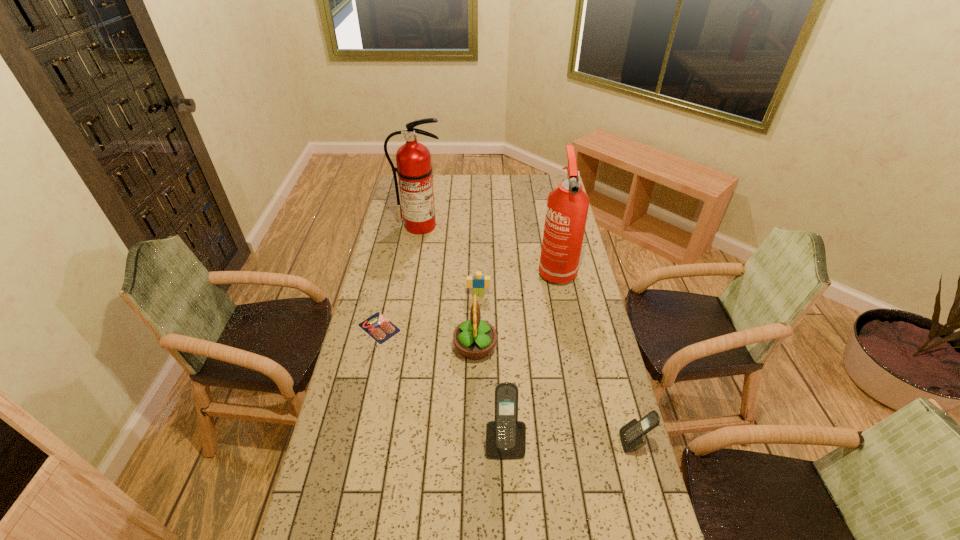
The height and width of the screenshot is (540, 960). I want to click on the left cellular telephone, so click(505, 436).

Where is `the shorter cellular telephone`? Image resolution: width=960 pixels, height=540 pixels. the shorter cellular telephone is located at coordinates (632, 435).

Image resolution: width=960 pixels, height=540 pixels. I want to click on the right cellular telephone, so click(x=632, y=435).

Find the location of a particular element. The width and height of the screenshot is (960, 540). the farthest object is located at coordinates (414, 169).

Find the location of a particular element. The width and height of the screenshot is (960, 540). the farther fire extinguisher is located at coordinates (414, 169).

Identify the location of the sixth tallest object. The height and width of the screenshot is (540, 960). (478, 282).

Identify the location of the third farthest object. (478, 282).

Find the location of `the nearer fire extinguisher`. the nearer fire extinguisher is located at coordinates (567, 207).

This screenshot has width=960, height=540. In order to click on the second farthest object in this screenshot , I will do [x=567, y=207].

Locate an element on the screen. Image resolution: width=960 pixels, height=540 pixels. salami is located at coordinates (377, 326).